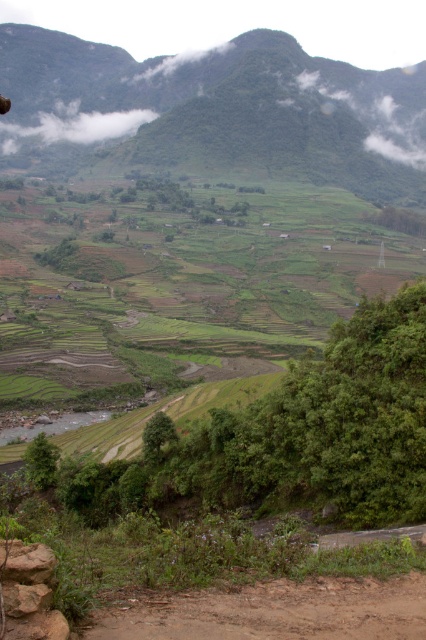
Question: Which point is closer to the camera?

Choices:
 (A) green grassy mountain at upper center
 (B) brown dirt track at lower center

Answer: (B)

Question: Does green grassy mountain at upper center lie behind brown dirt track at lower center?

Choices:
 (A) no
 (B) yes

Answer: (B)

Question: Is green grassy mountain at upper center smaller than brown dirt track at lower center?

Choices:
 (A) yes
 (B) no

Answer: (B)

Question: Which point is closer to the camera?

Choices:
 (A) brown dirt track at lower center
 (B) green grassy mountain at upper center

Answer: (A)

Question: Does green grassy mountain at upper center have a lesser width compared to brown dirt track at lower center?

Choices:
 (A) yes
 (B) no

Answer: (B)